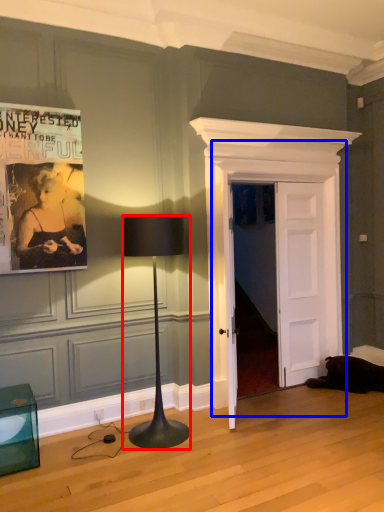
Question: Among these objects, which one is nearest to the camera, lamp (highlighted by a red box) or door (highlighted by a blue box)?

Choices:
 (A) lamp
 (B) door

Answer: (A)